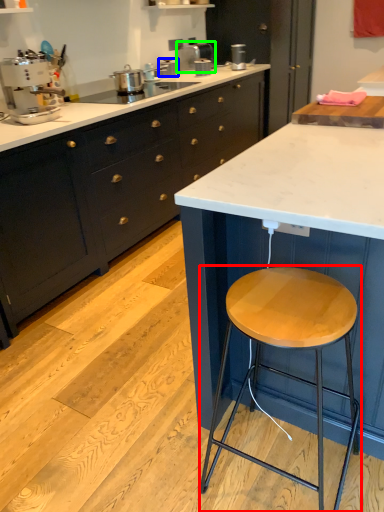
Question: Estimate the real-world distances between objects in this image. Which object is farther from stool (highlighted by a red box), appliance (highlighted by a blue box) or appliance (highlighted by a green box)?

Choices:
 (A) appliance
 (B) appliance

Answer: (B)